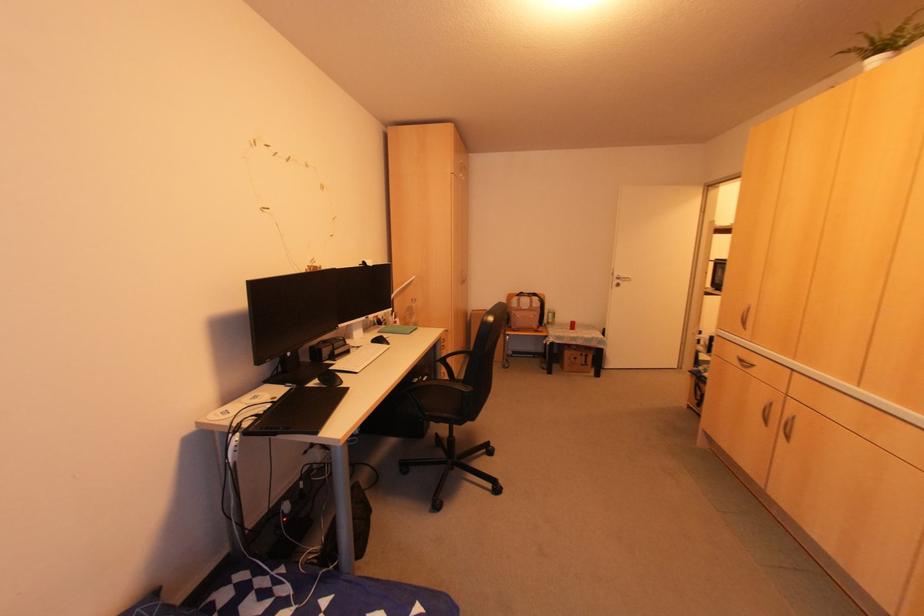
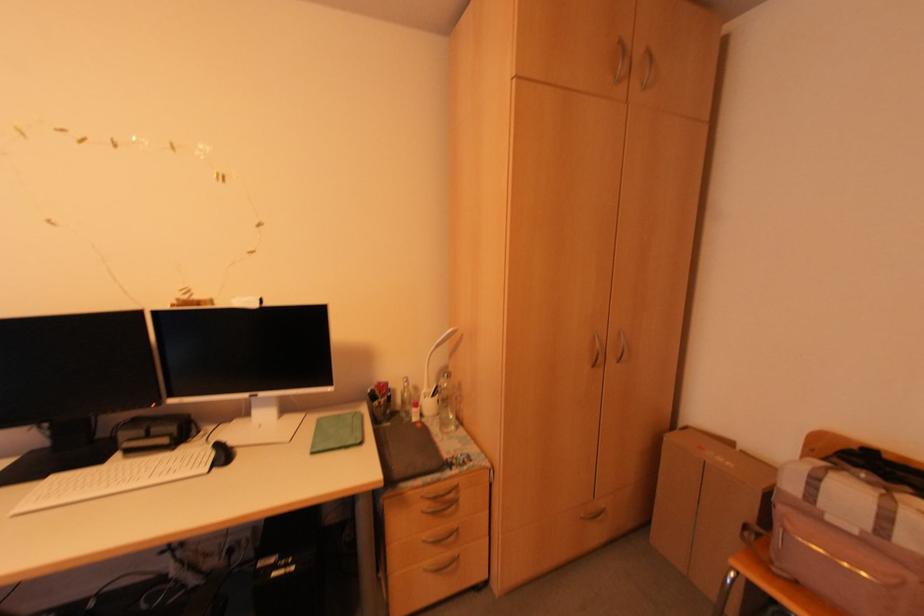
The point at (460, 346) is marked in the first image. Where is the corresponding point in the second image?

(602, 506)